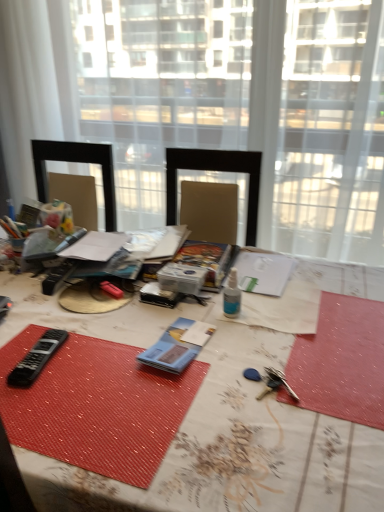
Where is `free space to the back side of black plastic remote at lower left, the first equipment from the left`? This screenshot has width=384, height=512. free space to the back side of black plastic remote at lower left, the first equipment from the left is located at coordinates point(61,317).